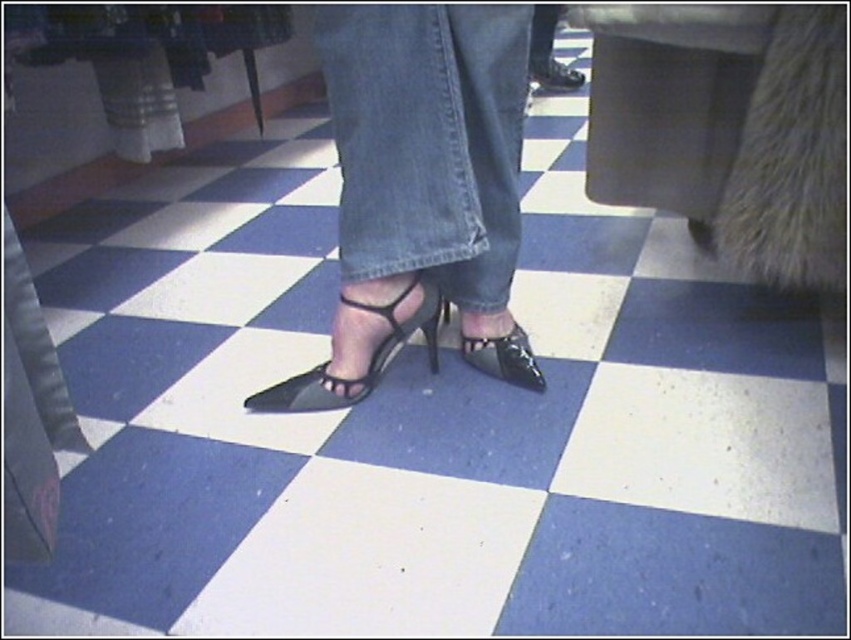
What are the coordinates of `denim at center` in the screenshot? It's located at click(x=427, y=141).

Describe the element at coordinates (427, 141) in the screenshot. I see `denim at center` at that location.

The width and height of the screenshot is (851, 640). In order to click on denim at center in this screenshot , I will do coord(427,141).

Between black leather sandal at center and shiny black shoe at center, which one has less height?

shiny black shoe at center

Which is below, black leather sandal at center or shiny black shoe at center?

Positioned lower is black leather sandal at center.

Between point (389, 342) and point (490, 369), which one is positioned in front?

Point (389, 342)

Locate an element on the screen. The image size is (851, 640). black leather sandal at center is located at coordinates pyautogui.click(x=368, y=358).

Does denim at center come in front of shiny black shoe at center?

Yes.

Does denim at center appear on the left side of shiny black shoe at center?

Correct, you'll find denim at center to the left of shiny black shoe at center.

The image size is (851, 640). I want to click on denim at center, so click(x=427, y=141).